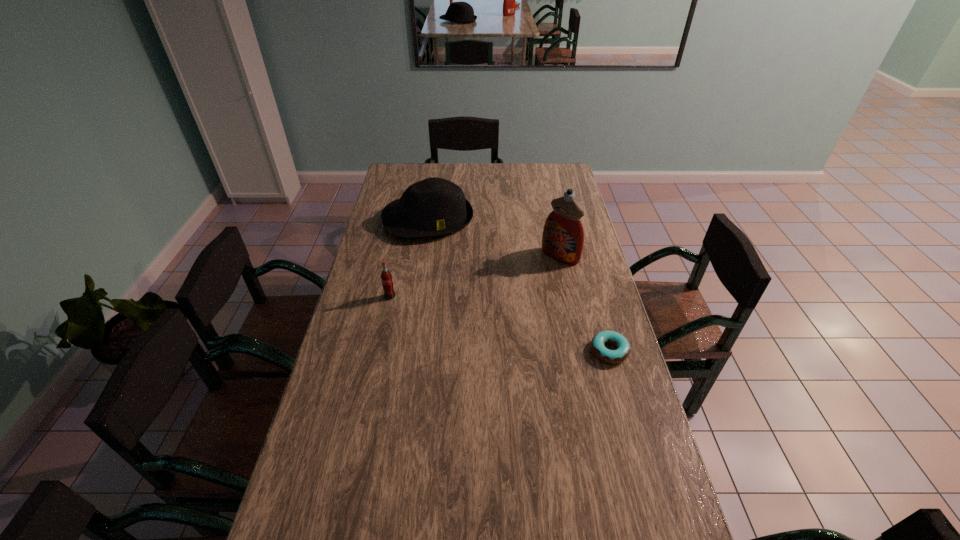
Where is `free space located on the front surface of the detergent`? free space located on the front surface of the detergent is located at coordinates (538, 276).

The width and height of the screenshot is (960, 540). Identify the location of vacant space located 0.180m on the front-facing side of the farthest object. (451, 271).

In order to click on blank space located 0.050m on the front-facing side of the farthest object in this screenshot , I will do `click(443, 251)`.

At what (x,y) coordinates should I click in order to perform the action: click on free space located 0.060m on the front-facing side of the farthest object. Please return your answer as a coordinate pair (x, y). This screenshot has width=960, height=540. Looking at the image, I should click on (444, 252).

The image size is (960, 540). I want to click on soda bottle located at the left edge, so click(386, 277).

Where is `fedora at the left edge`? This screenshot has height=540, width=960. fedora at the left edge is located at coordinates (434, 206).

The height and width of the screenshot is (540, 960). Find the location of `doughnut at the right edge`. doughnut at the right edge is located at coordinates (622, 352).

In order to click on detergent that is at the right edge in this screenshot , I will do `click(563, 236)`.

Image resolution: width=960 pixels, height=540 pixels. Identify the location of vacant space at the far edge of the desktop. (534, 166).

Where is `free location at the left edge of the desktop`? This screenshot has height=540, width=960. free location at the left edge of the desktop is located at coordinates (363, 260).